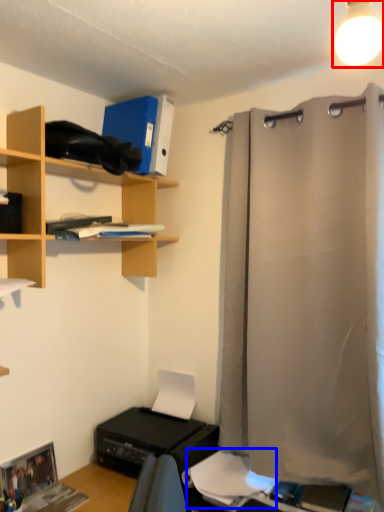
Question: Among these objects, which one is farthest to the camera, light fixture (highlighted by a red box) or sheet (highlighted by a blue box)?

Choices:
 (A) light fixture
 (B) sheet

Answer: (B)